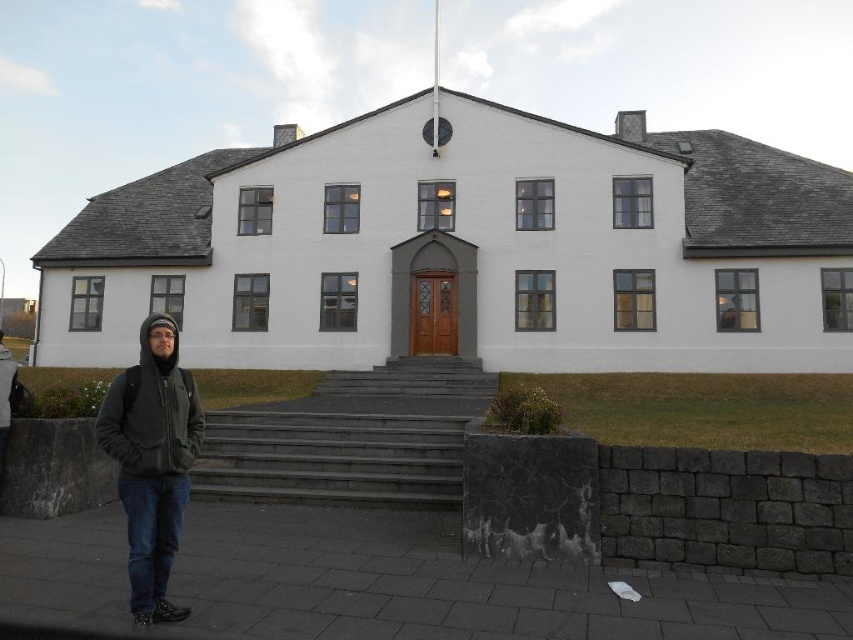
You are standing in front of the white matte building at center and want to see the dark gray hoodie at lower left. Which direction should you look relative to your current position?

You should look downward since the dark gray hoodie at lower left is shorter than the white matte building at center.

You are standing in front of the white matte building at center and want to take a photo of the dark gray hoodie at lower left. Which direction should you move to frame both objects in your camera viewfinder?

You should move to the right side of the white matte building at center to frame both the building and the dark gray hoodie at lower left in your camera viewfinder since the building is positioned on the right side of the hoodie.

You are standing in front of the building and see the dark gray concrete stairs at center and the dark gray hoodie at lower left. Which object takes up more space in the image?

The dark gray concrete stairs at center is bigger than dark gray hoodie at lower left, so it takes up more space in the image.